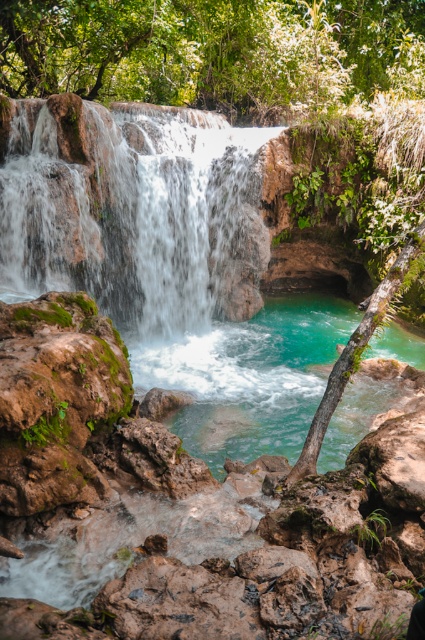
You are standing at the edge of the waterfall and see the point marked at coordinates [127,211]. What can you observe at that point?

At the coordinates [127,211], there is translucent white water at center, which is part of the cascading waterfall surrounded by lush greenery.

You are standing at the edge of the waterfall and see the translucent white water at center and the turquoise glossy water at center. Which one is positioned to the left side from your viewpoint?

The translucent white water at center is positioned to the left of the turquoise glossy water at center.

You are standing at the edge of the waterfall and see both the translucent white water at center and the turquoise glossy water at center. Which one is closer to you?

A: The translucent white water at center is closer to you because it is further to the viewer than the turquoise glossy water at center.